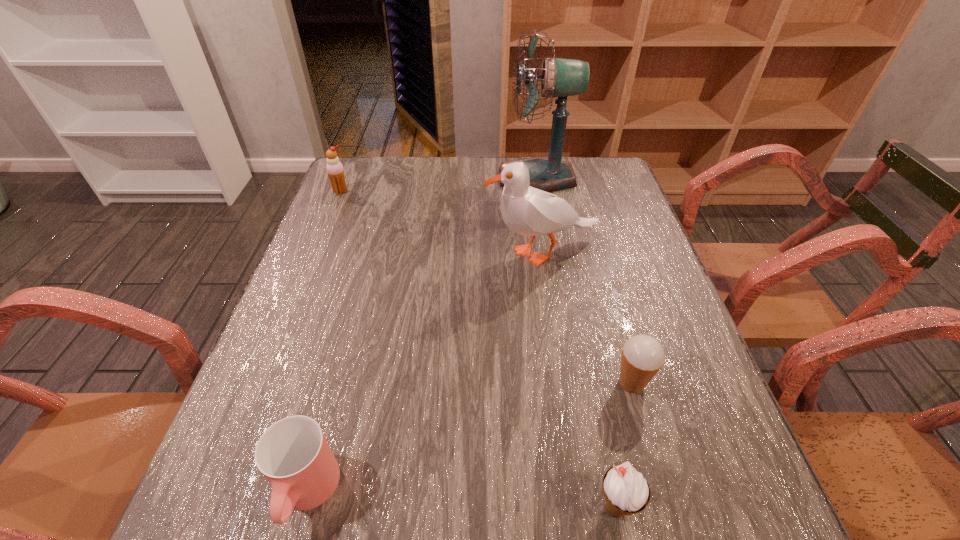
In the image, there is a desktop. At what (x,y) coordinates should I click in order to perform the action: click on vacant space at the far right corner. Please return your answer as a coordinate pair (x, y). The height and width of the screenshot is (540, 960). Looking at the image, I should click on (587, 173).

Where is `free space between the fan and the leftmost icecream`? free space between the fan and the leftmost icecream is located at coordinates (439, 185).

The width and height of the screenshot is (960, 540). I want to click on blank region between the second icecream from left to right and the rightmost icecream, so click(x=624, y=445).

The width and height of the screenshot is (960, 540). I want to click on empty space between the second icecream from right to left and the rightmost icecream, so click(624, 445).

Image resolution: width=960 pixels, height=540 pixels. In order to click on vacant area between the nearest icecream and the tallest object in this screenshot , I will do `click(576, 342)`.

The width and height of the screenshot is (960, 540). In order to click on vacant space that is in between the rightmost icecream and the tallest icecream in this screenshot , I will do `click(486, 287)`.

The width and height of the screenshot is (960, 540). What are the coordinates of `empty space that is in between the third nearest object and the second icecream from right to left` in the screenshot? It's located at (624, 445).

Identify which object is the fourth nearest to the second farthest icecream. Please provide its 2D coordinates. Your answer should be formatted as a tuple, i.e. [(x, y)], where the tuple contains the x and y coordinates of a point satisfying the conditions above.

[(561, 78)]

Locate which object is the fifth closest to the cup. Please provide its 2D coordinates. Your answer should be formatted as a tuple, i.e. [(x, y)], where the tuple contains the x and y coordinates of a point satisfying the conditions above.

[(561, 78)]

You are a GUI agent. You are given a task and a screenshot of the screen. Output one action in this format:
    pyautogui.click(x=<x>, y=<y>)
    Task: Click on the third closest icecream to the fan
    The width and height of the screenshot is (960, 540).
    Given the screenshot: What is the action you would take?
    pyautogui.click(x=623, y=486)